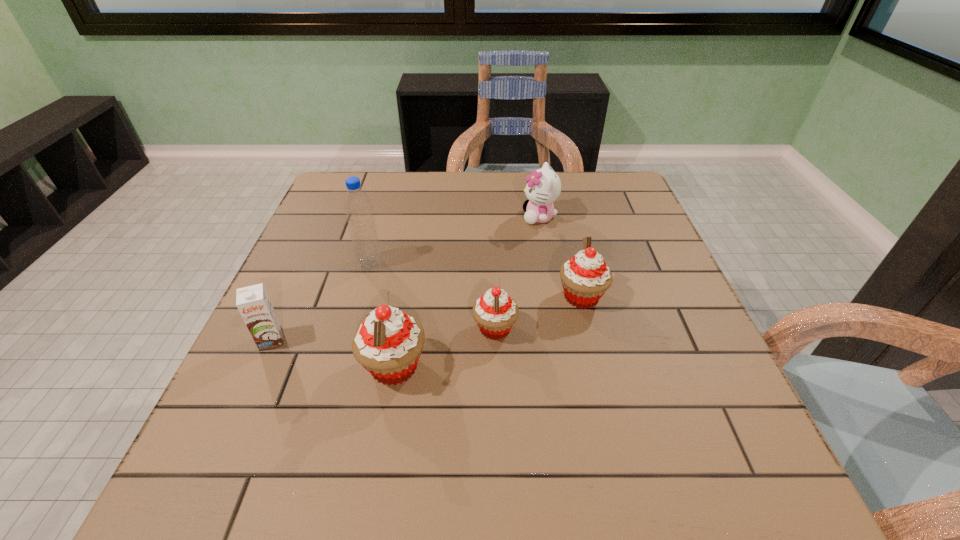
This screenshot has height=540, width=960. I want to click on free space located on the back of the second tallest cupcake, so click(557, 197).

I want to click on free region located on the back of the tallest object, so click(x=395, y=176).

You are a GUI agent. You are given a task and a screenshot of the screen. Output one action in this format:
    pyautogui.click(x=<x>, y=<y>)
    Task: Click on the free space located 0.360m on the front-facing side of the kitten
    This screenshot has width=960, height=540.
    Given the screenshot: What is the action you would take?
    pyautogui.click(x=391, y=217)

Locate an element on the screen. free point located 0.190m on the front-facing side of the kitten is located at coordinates (452, 217).

Identify the location of vacant space located 0.210m on the front-facing side of the kitten. The width and height of the screenshot is (960, 540). 445,217.

The image size is (960, 540). What are the coordinates of `free location located on the right of the leftmost object` in the screenshot? It's located at (316, 340).

Where is `object located at the far edge`? The width and height of the screenshot is (960, 540). object located at the far edge is located at coordinates click(543, 187).

I want to click on object that is at the near edge, so click(388, 344).

The height and width of the screenshot is (540, 960). Identify the location of water bottle that is at the left edge. (358, 209).

This screenshot has width=960, height=540. What are the coordinates of `chocolate milk that is at the left edge` in the screenshot? It's located at (253, 303).